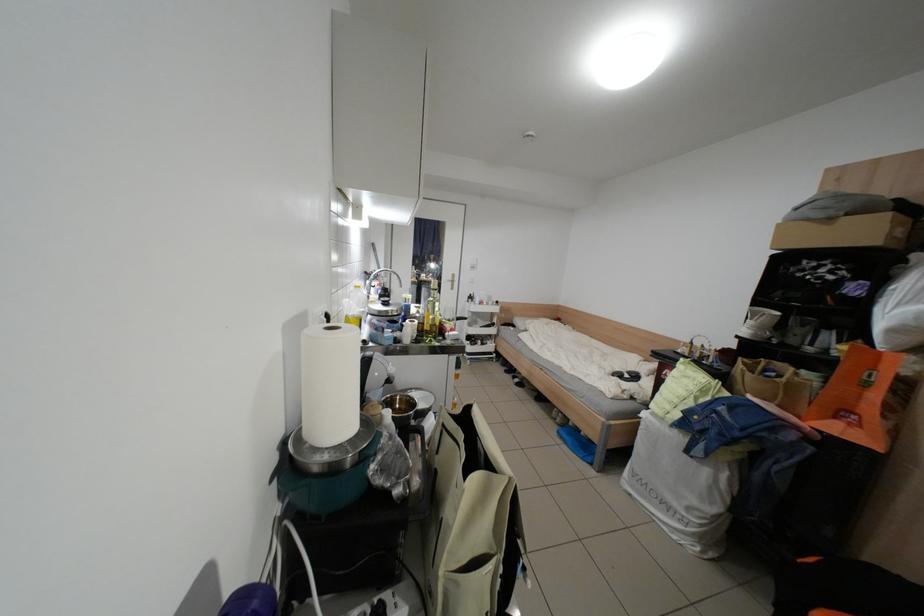
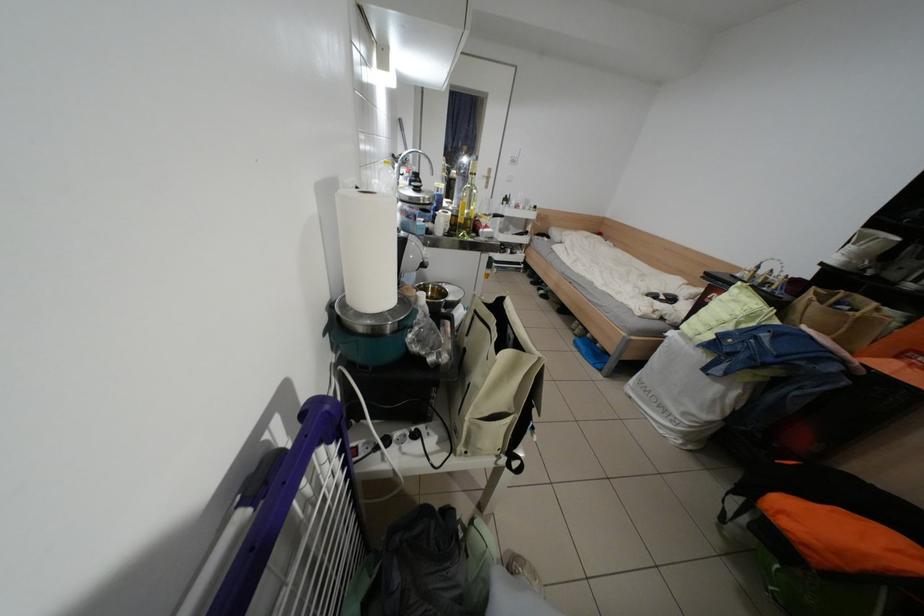
Locate, in the second image, the point that corresponds to the point at 760,375 in the first image.

(827, 305)